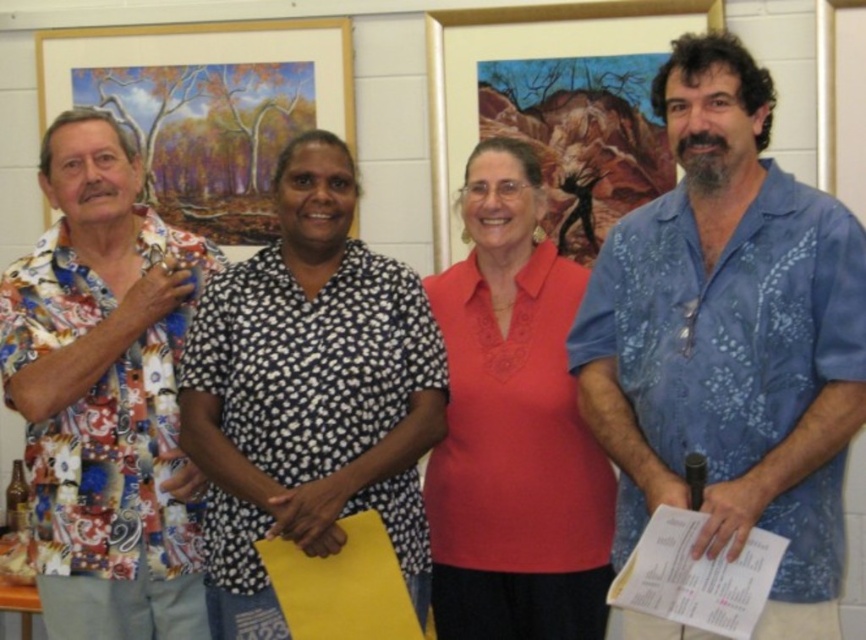
Question: Does printed cotton shirt at left have a larger size compared to matte coral blouse at center?

Choices:
 (A) yes
 (B) no

Answer: (B)

Question: Does blue floral shirt at center come in front of matte coral blouse at center?

Choices:
 (A) no
 (B) yes

Answer: (B)

Question: Which object appears farthest from the camera in this image?

Choices:
 (A) printed cotton shirt at left
 (B) matte coral blouse at center

Answer: (B)

Question: From the image, what is the correct spatial relationship of printed cotton shirt at left in relation to matte coral blouse at center?

Choices:
 (A) above
 (B) below

Answer: (A)

Question: Which point is farther from the camera taking this photo?

Choices:
 (A) (217, 577)
 (B) (813, 598)
 (C) (435, 516)

Answer: (C)

Question: Which of these objects is positioned closest to the printed cotton shirt at left?

Choices:
 (A) blue floral shirt at center
 (B) black dotted shirt at center

Answer: (B)